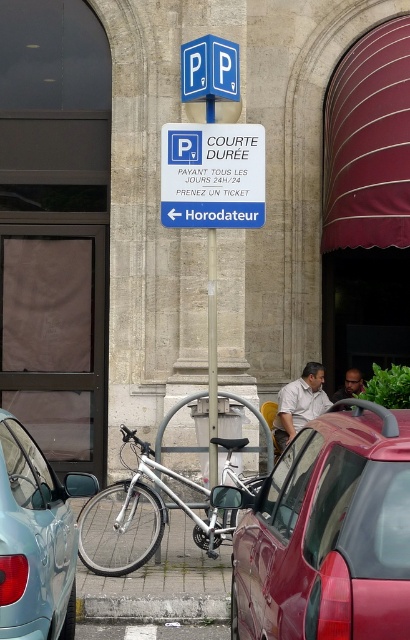
Question: Which object is positioned closest to the light blue matte car at lower left?

Choices:
 (A) silver metallic bicycle at center
 (B) gray concrete curb at lower center

Answer: (B)

Question: Can you confirm if light blue matte car at lower left is positioned below light brown shirt at center?

Choices:
 (A) no
 (B) yes

Answer: (B)

Question: Considering the relative positions of gray concrete curb at lower center and matte black shirt at center in the image provided, where is gray concrete curb at lower center located with respect to matte black shirt at center?

Choices:
 (A) above
 (B) below

Answer: (B)

Question: Among these objects, which one is farthest from the camera?

Choices:
 (A) gray concrete curb at lower center
 (B) silver metallic bicycle at center
 (C) blue plastic sign at center
 (D) matte black shirt at center

Answer: (D)

Question: Does metallic red car at center lie in front of matte black shirt at center?

Choices:
 (A) no
 (B) yes

Answer: (B)

Question: Which point is farther to the camera?

Choices:
 (A) gray concrete curb at lower center
 (B) light blue matte car at lower left

Answer: (A)